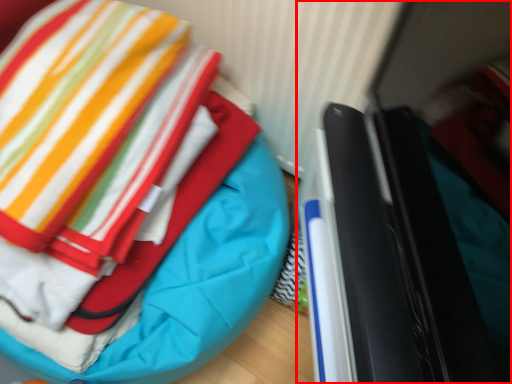
Question: From the image's perspective, considering the relative positions of laptop (annotated by the red box) and bean bag chair in the image provided, where is laptop (annotated by the red box) located with respect to the staircase?

Choices:
 (A) above
 (B) below

Answer: (B)